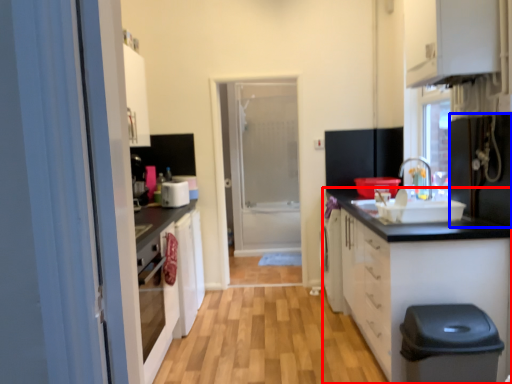
Question: Which object appears farthest to the camera in this image, cabinetry (highlighted by a red box) or appliance (highlighted by a blue box)?

Choices:
 (A) cabinetry
 (B) appliance

Answer: (A)